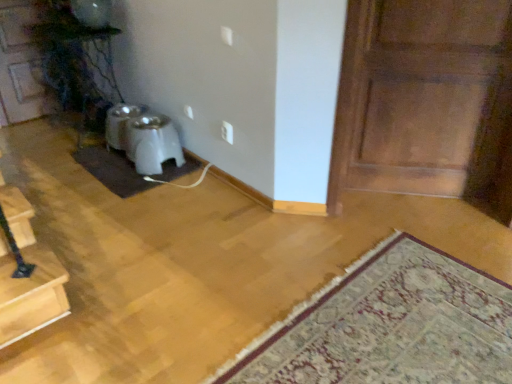
Locate an element on the screen. The width and height of the screenshot is (512, 384). vacant space underneath carpeted rug at lower right (from a real-world perspective) is located at coordinates (401, 326).